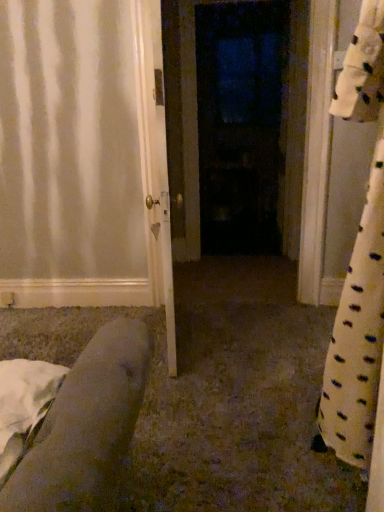
Find the location of `dark matte door at center, marked as the second door in a front-to-back arrangement`. dark matte door at center, marked as the second door in a front-to-back arrangement is located at coordinates (242, 124).

The image size is (384, 512). What do you see at coordinates (242, 124) in the screenshot?
I see `dark matte door at center, placed as the first door when sorted from right to left` at bounding box center [242, 124].

The image size is (384, 512). Describe the element at coordinates (155, 160) in the screenshot. I see `white glossy door at center, the 1th door when ordered from left to right` at that location.

I want to click on white glossy door at center, the 2th door viewed from the right, so click(x=155, y=160).

Measure the distance between point (146,59) and camera.

Point (146,59) is 2.21 meters away from camera.

In order to face white glossy door at center, which is the first door from front to back, should I rotate leftwards or rightwards?

A 3.859 degree turn to the left will do.

At what (x,y) coordinates should I click in order to perform the action: click on dark matte door at center, marked as the second door in a front-to-back arrangement. Please return your answer as a coordinate pair (x, y). The width and height of the screenshot is (384, 512). Looking at the image, I should click on tap(242, 124).

Which object is positioned more to the left, dark matte door at center, marked as the second door in a front-to-back arrangement, or white glossy door at center, which is the first door from front to back?

white glossy door at center, which is the first door from front to back, is more to the left.

Does dark matte door at center, acting as the 1th door starting from the back, lie in front of white glossy door at center, which is the first door from front to back?

No, it is not.

Which point is more distant from viewer, (239,213) or (159,202)?

The point (239,213) is farther.

From the image's perspective, between dark matte door at center, marked as the second door in a front-to-back arrangement, and white glossy door at center, which is the first door from front to back, who is located below?

white glossy door at center, which is the first door from front to back, appears lower in the image.

From a real-world perspective, relative to white glossy door at center, the 1th door when ordered from left to right, is dark matte door at center, marked as the second door in a front-to-back arrangement, vertically above or below?

From a real-world perspective, dark matte door at center, marked as the second door in a front-to-back arrangement, is physically above white glossy door at center, the 1th door when ordered from left to right.

Does dark matte door at center, marked as the second door in a front-to-back arrangement, have a greater width compared to white glossy door at center, the 2th door viewed from the right?

Indeed, dark matte door at center, marked as the second door in a front-to-back arrangement, has a greater width compared to white glossy door at center, the 2th door viewed from the right.

Consider the image. Considering the sizes of objects dark matte door at center, placed as the first door when sorted from right to left, and white glossy door at center, which is the first door from front to back, in the image provided, who is shorter, dark matte door at center, placed as the first door when sorted from right to left, or white glossy door at center, which is the first door from front to back,?

Standing shorter between the two is white glossy door at center, which is the first door from front to back.

In the scene shown: Is dark matte door at center, placed as the first door when sorted from right to left, bigger or smaller than white glossy door at center, the 1th door when ordered from left to right?

dark matte door at center, placed as the first door when sorted from right to left, is bigger than white glossy door at center, the 1th door when ordered from left to right.

Is white glossy door at center, arranged as the 2th door when viewed from the back, located within dark matte door at center, marked as the second door in a front-to-back arrangement?

No.

Is dark matte door at center, acting as the 1th door starting from the back, far away from white glossy door at center, the 1th door when ordered from left to right?

dark matte door at center, acting as the 1th door starting from the back, is far away from white glossy door at center, the 1th door when ordered from left to right.

Is dark matte door at center, acting as the 1th door starting from the back, facing away from white glossy door at center, the 2th door viewed from the right?

That's not correct — dark matte door at center, acting as the 1th door starting from the back, is not looking away from white glossy door at center, the 2th door viewed from the right.

Can you tell me how much dark matte door at center, acting as the 1th door starting from the back, and white glossy door at center, the 1th door when ordered from left to right, differ in facing direction?

There is a 98.3-degree angle between the facing directions of dark matte door at center, acting as the 1th door starting from the back, and white glossy door at center, the 1th door when ordered from left to right.

Where is `door on the right side of white glossy door at center, the 2th door viewed from the right`? This screenshot has width=384, height=512. door on the right side of white glossy door at center, the 2th door viewed from the right is located at coordinates (242, 124).

Would you say white glossy door at center, arranged as the 2th door when viewed from the back, is to the left or to the right of dark matte door at center, which appears as the 2th door when viewed from the left, in the picture?

Based on their positions, white glossy door at center, arranged as the 2th door when viewed from the back, is located to the left of dark matte door at center, which appears as the 2th door when viewed from the left.

Which object is further away from the camera taking this photo, white glossy door at center, which is the first door from front to back, or dark matte door at center, marked as the second door in a front-to-back arrangement?

dark matte door at center, marked as the second door in a front-to-back arrangement, is more distant.

Considering the points (169, 228) and (212, 165), which point is behind, point (169, 228) or point (212, 165)?

Positioned behind is point (212, 165).

In the scene shown: From the image's perspective, would you say white glossy door at center, the 1th door when ordered from left to right, is positioned over dark matte door at center, marked as the second door in a front-to-back arrangement?

Incorrect, from the image's perspective, white glossy door at center, the 1th door when ordered from left to right, is lower than dark matte door at center, marked as the second door in a front-to-back arrangement.

From a real-world perspective, which is physically below, white glossy door at center, the 1th door when ordered from left to right, or dark matte door at center, marked as the second door in a front-to-back arrangement?

white glossy door at center, the 1th door when ordered from left to right, from a real-world perspective.

Which object is thinner, white glossy door at center, the 2th door viewed from the right, or dark matte door at center, acting as the 1th door starting from the back?

With smaller width is white glossy door at center, the 2th door viewed from the right.

Which of these two, white glossy door at center, arranged as the 2th door when viewed from the back, or dark matte door at center, marked as the second door in a front-to-back arrangement, stands shorter?

Standing shorter between the two is white glossy door at center, arranged as the 2th door when viewed from the back.

Is white glossy door at center, which is the first door from front to back, bigger or smaller than dark matte door at center, which appears as the 2th door when viewed from the left?

white glossy door at center, which is the first door from front to back, is smaller than dark matte door at center, which appears as the 2th door when viewed from the left.

Is white glossy door at center, the 1th door when ordered from left to right, not inside dark matte door at center, acting as the 1th door starting from the back?

Yes.

Are white glossy door at center, the 1th door when ordered from left to right, and dark matte door at center, which appears as the 2th door when viewed from the left, located far from each other?

Yes, white glossy door at center, the 1th door when ordered from left to right, is far from dark matte door at center, which appears as the 2th door when viewed from the left.

Could you tell me if white glossy door at center, the 2th door viewed from the right, is turned towards dark matte door at center, acting as the 1th door starting from the back?

No, white glossy door at center, the 2th door viewed from the right, is not aimed at dark matte door at center, acting as the 1th door starting from the back.

How far apart are white glossy door at center, arranged as the 2th door when viewed from the back, and dark matte door at center, marked as the second door in a front-to-back arrangement?

white glossy door at center, arranged as the 2th door when viewed from the back, is 6.24 feet away from dark matte door at center, marked as the second door in a front-to-back arrangement.

The height and width of the screenshot is (512, 384). In order to click on door below the dark matte door at center, which appears as the 2th door when viewed from the left (from a real-world perspective) in this screenshot , I will do `click(155, 160)`.

Where is `door behind the white glossy door at center, which is the first door from front to back`? door behind the white glossy door at center, which is the first door from front to back is located at coordinates (242, 124).

In the image, there is a white glossy door at center, the 2th door viewed from the right. Find the location of `door above it (from the image's perspective)`. door above it (from the image's perspective) is located at coordinates (242, 124).